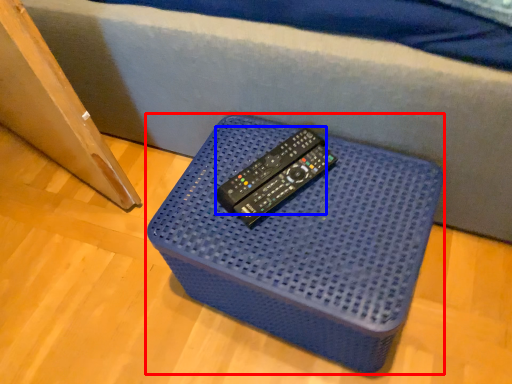
Question: Which point is closer to the camera, furniture (highlighted by a red box) or remote (highlighted by a blue box)?

Choices:
 (A) furniture
 (B) remote

Answer: (A)